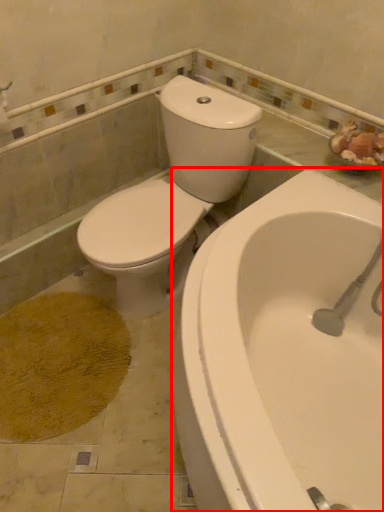
Question: Observing the image, what is the correct spatial positioning of bathtub (annotated by the red box) in reference to toilet?

Choices:
 (A) right
 (B) left

Answer: (A)